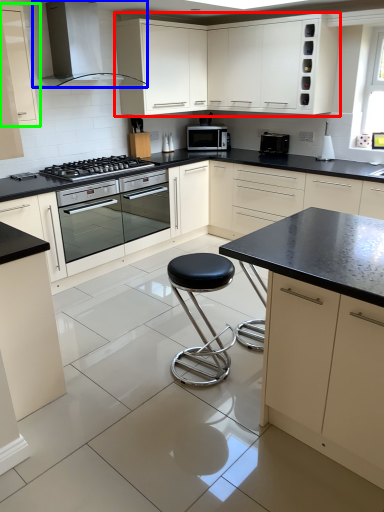
Question: Considering the real-world distances, which object is farthest from cabinetry (highlighted by a red box)? home appliance (highlighted by a blue box) or cabinetry (highlighted by a green box)?

Choices:
 (A) home appliance
 (B) cabinetry

Answer: (B)